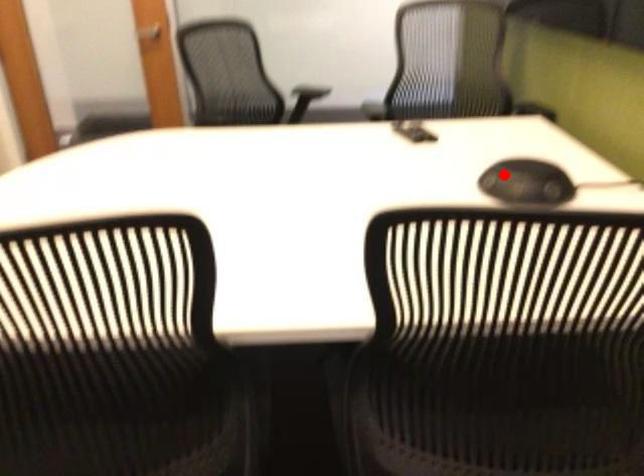
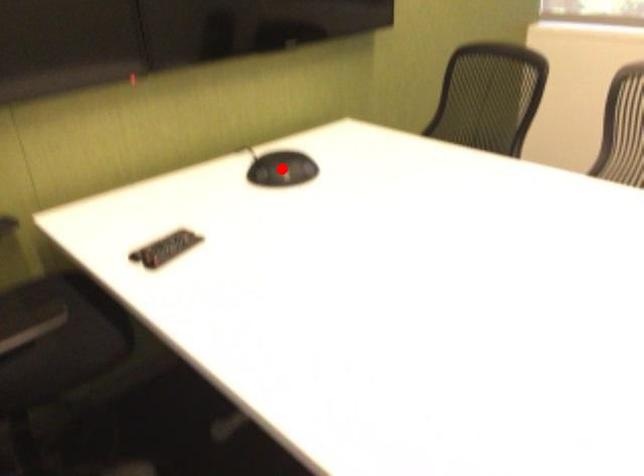
I am providing you with two images of the same scene from different viewpoints. A red point is marked on the first image and another point is marked on the second image. Does the point marked in image1 correspond to the same location as the one in image2?

Yes